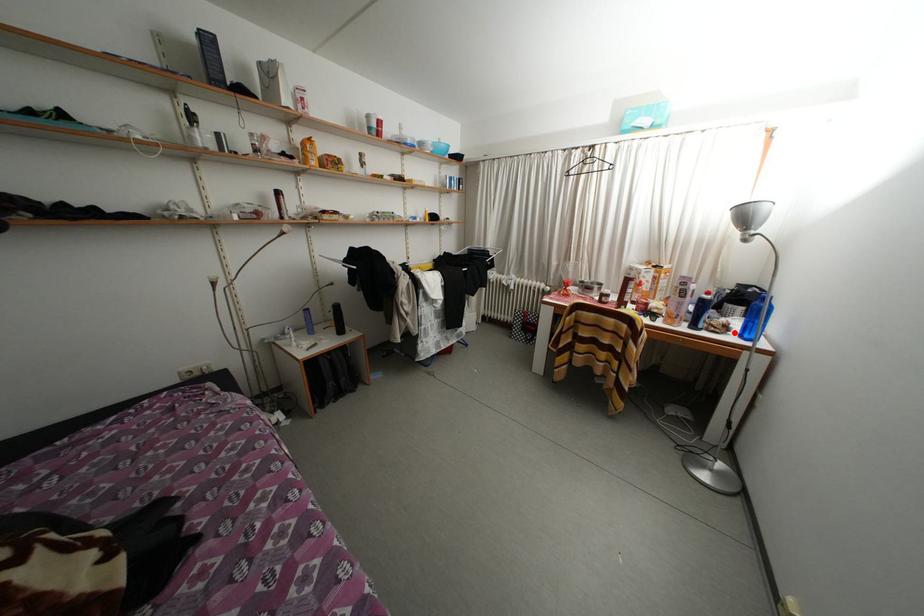
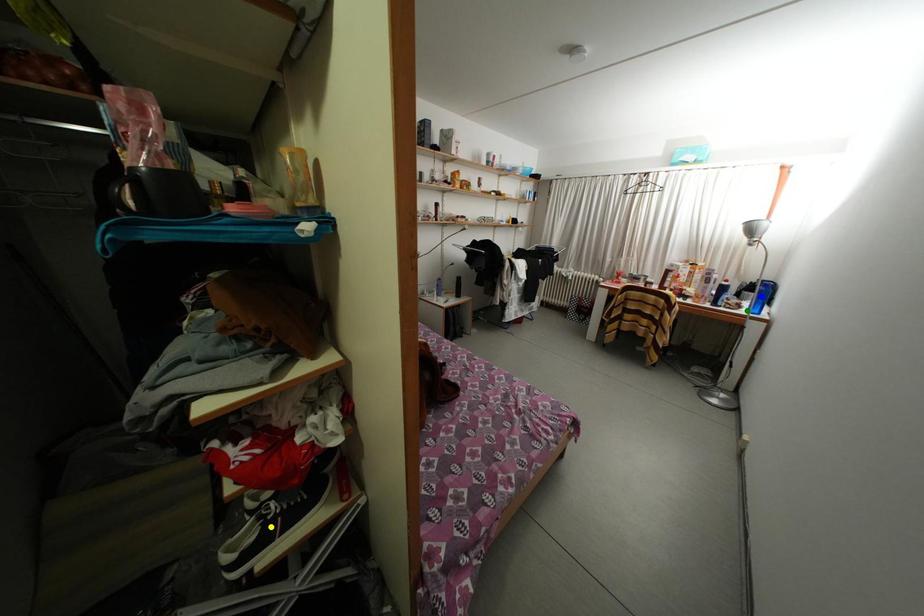
Question: I am providing you with two images of the same scene from different viewpoints. A red point is marked on the first image. You are given multiple points on the second image. Which point in image 2 represents the same 3d spot as the red point in image 1?

Choices:
 (A) green point
 (B) yellow point
 (C) blue point

Answer: (A)